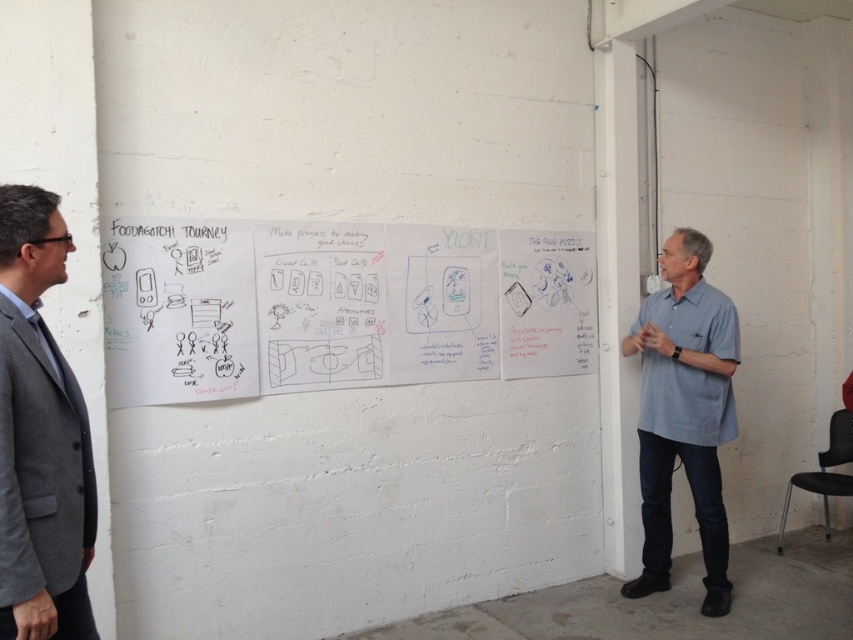
Question: Which of the following is the farthest from the observer?

Choices:
 (A) (653, 330)
 (B) (0, 289)
 (C) (248, 378)

Answer: (A)

Question: Is gray wool suit at left smaller than light blue shirt at right?

Choices:
 (A) no
 (B) yes

Answer: (B)

Question: From the image, what is the correct spatial relationship of white paper at center in relation to light blue shirt at right?

Choices:
 (A) left
 (B) right

Answer: (A)

Question: Can you confirm if white paper at center is positioned to the right of light blue shirt at right?

Choices:
 (A) no
 (B) yes

Answer: (A)

Question: Which of the following is the farthest from the observer?

Choices:
 (A) [x=235, y=337]
 (B) [x=93, y=547]

Answer: (A)

Question: Which object is the closest to the white paper at center?

Choices:
 (A) gray wool suit at left
 (B) light blue shirt at right

Answer: (B)